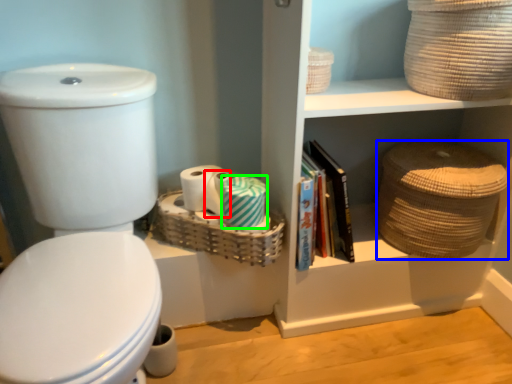
Question: Considering the real-world distances, which object is farthest from toilet paper (highlighted by a red box)? basket (highlighted by a blue box) or toilet paper (highlighted by a green box)?

Choices:
 (A) basket
 (B) toilet paper

Answer: (A)